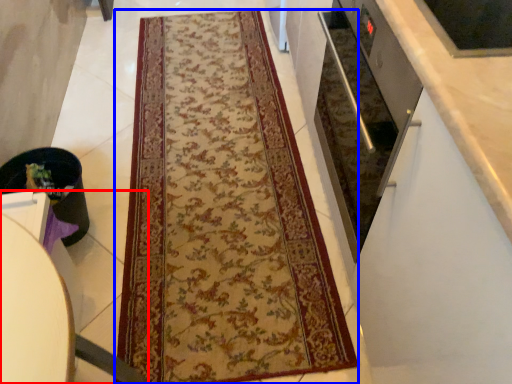
Question: Which object is further to the camera taking this photo, furniture (highlighted by a red box) or mat (highlighted by a blue box)?

Choices:
 (A) furniture
 (B) mat

Answer: (B)